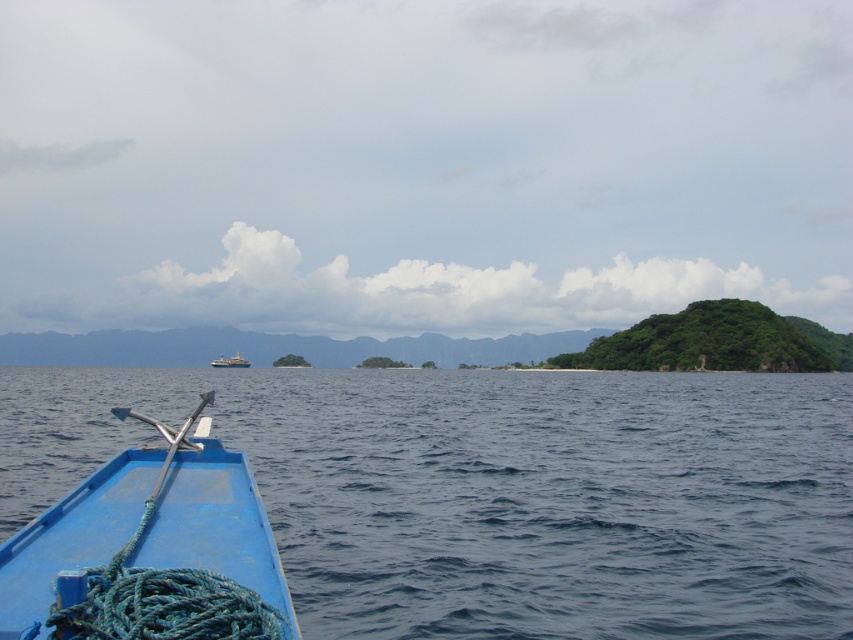
Question: Is blue water at lower left thinner than green leafy island at right?

Choices:
 (A) yes
 (B) no

Answer: (B)

Question: Among these points, which one is farthest from the camera?

Choices:
 (A) (184, 536)
 (B) (770, 538)
 (C) (213, 364)

Answer: (C)

Question: Can you confirm if blue water at lower left is positioned above green leafy island at right?

Choices:
 (A) yes
 (B) no

Answer: (B)

Question: Which is farther from the green leafy island at right?

Choices:
 (A) white plastic boat at center
 (B) blue matte boat at lower left
 (C) blue water at lower left

Answer: (B)

Question: Where is blue water at lower left located in relation to white plastic boat at center in the image?

Choices:
 (A) above
 (B) below

Answer: (A)

Question: Which object appears farthest from the camera in this image?

Choices:
 (A) green leafy island at right
 (B) blue water at lower left
 (C) white plastic boat at center

Answer: (C)